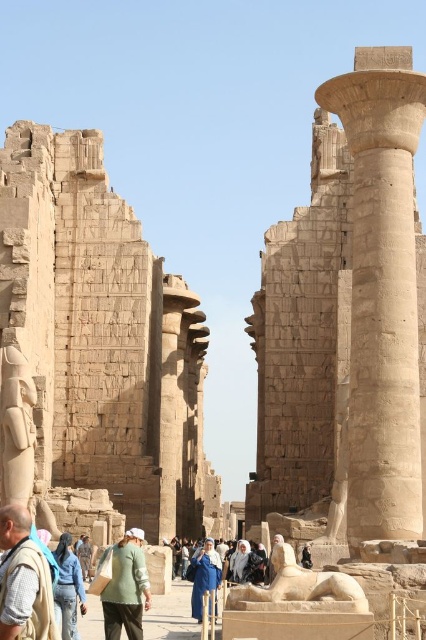
You are an archaeologist exploring the temple complex and notice a beige fabric backpack at lower left and a green cotton shirt at center. Which item is positioned higher in the scene?

The beige fabric backpack at lower left is above the green cotton shirt at center, so it is positioned higher in the scene.

You are standing at the entrance of the temple complex and see two points marked on the ground. The first point is at coordinate point (40, 582) and the second point is at coordinate point (144, 580). Which point is closer to you?

Point (40, 582) is closer to the viewer than point (144, 580).

You are a tour guide explaining the temple complex to visitors. You point to the beige stone wall at center and the green cotton shirt at center. Which object is taller?

The beige stone wall at center is taller than the green cotton shirt at center.